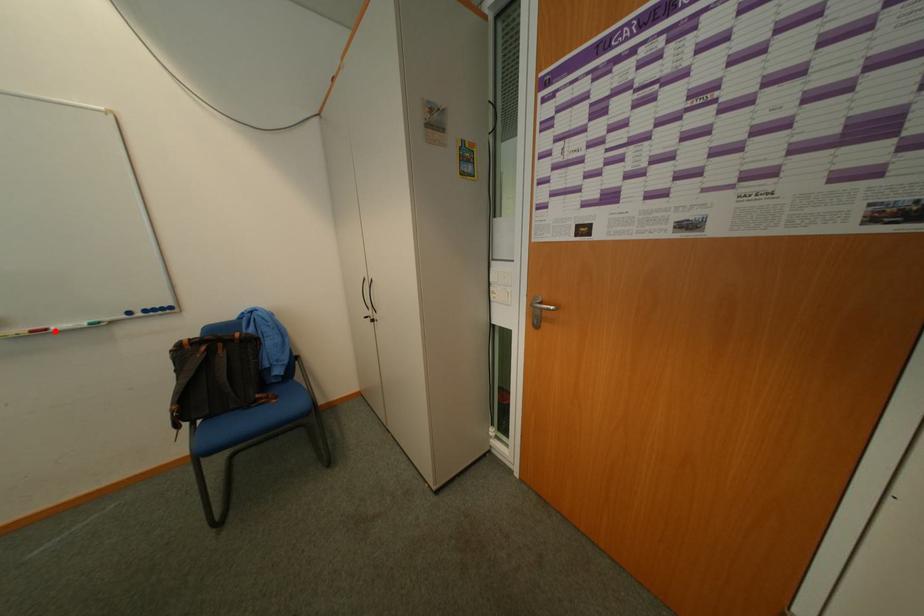
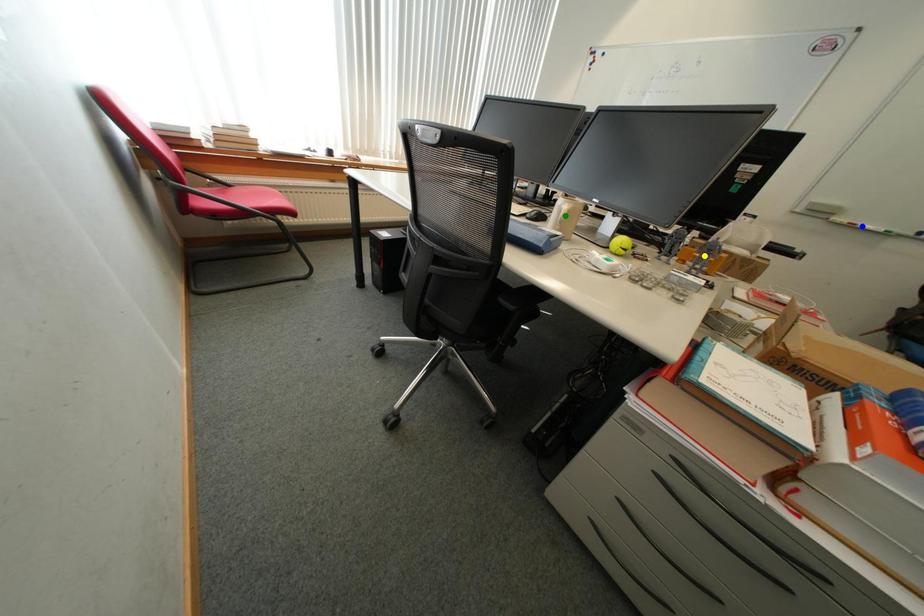
Question: I am providing you with two images of the same scene from different viewpoints. A red point is marked on the first image. You are given multiple points on the second image. Which point in image 2 represents the same 3d spot as the red point in image 1?

Choices:
 (A) green point
 (B) blue point
 (C) yellow point

Answer: (B)